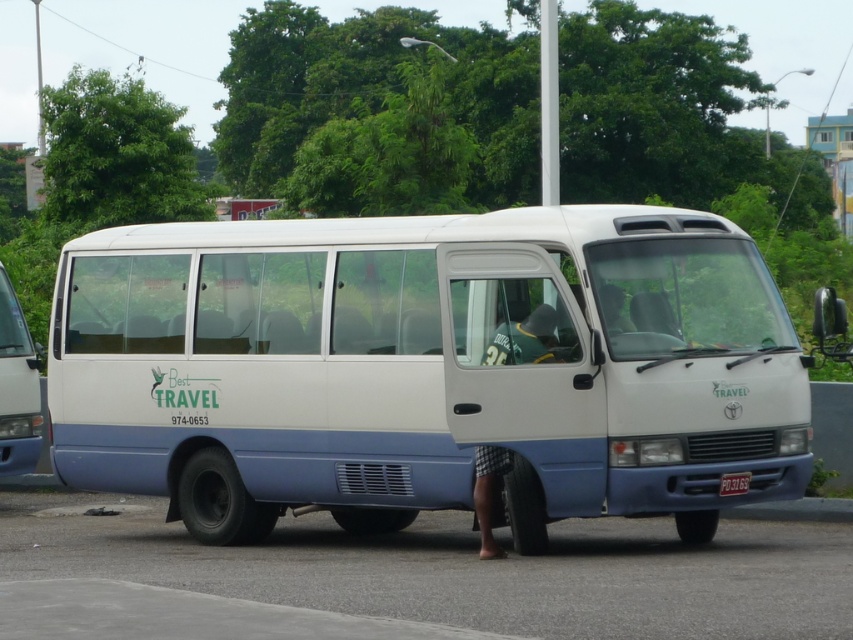
You are a delivery driver who needs to park your truck between the white matte van at center and the white matte van at left. The truck is 2.5 meters wide. Can you fit your truck between them?

The white matte van at center might be wider than white matte van at left. Therefore, it is uncertain if there is enough space to fit a 2.5 meter wide truck between them without knowing the exact width difference.

You are a delivery driver who needs to park your truck between the white matte van at center and the white matte van at left. The truck requires 3 meters of space to park. Can you fit your truck between them based on their sizes?

The white matte van at center is bigger than the white matte van at left, but the exact distance between them isn t provided. Without knowing the actual space available, it s impossible to determine if the truck can fit.